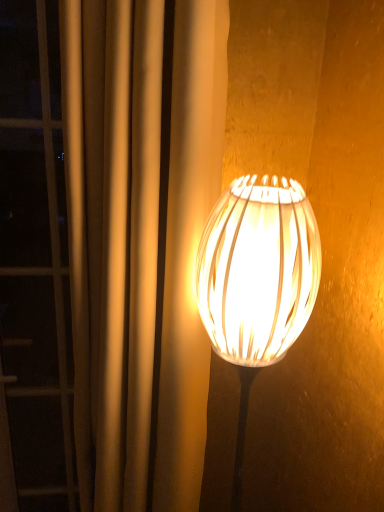
Question: Is point (84, 8) positioned closer to the camera than point (223, 274)?

Choices:
 (A) farther
 (B) closer

Answer: (A)

Question: Is silky beige curtain at right in front of or behind translucent white lampshade at center in the image?

Choices:
 (A) front
 (B) behind

Answer: (B)

Question: From the image's perspective, is silky beige curtain at right positioned above or below translucent white lampshade at center?

Choices:
 (A) above
 (B) below

Answer: (A)

Question: Would you say translucent white lampshade at center is to the left or to the right of silky beige curtain at right in the picture?

Choices:
 (A) right
 (B) left

Answer: (A)

Question: Considering the positions of point (244, 359) and point (137, 10), is point (244, 359) closer or farther from the camera than point (137, 10)?

Choices:
 (A) farther
 (B) closer

Answer: (A)

Question: Is translucent white lampshade at center situated inside silky beige curtain at right or outside?

Choices:
 (A) inside
 (B) outside

Answer: (B)

Question: Is translucent white lampshade at center wider or thinner than silky beige curtain at right?

Choices:
 (A) thin
 (B) wide

Answer: (A)